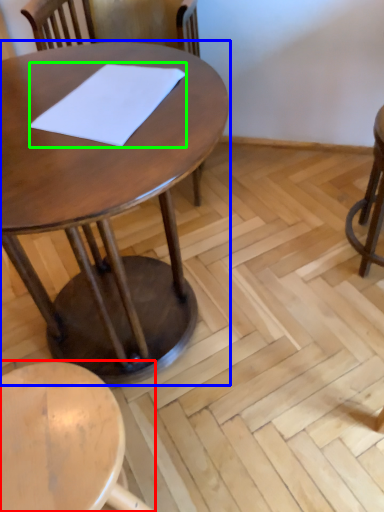
Question: Which object is the closest to the stool (highlighted by a red box)? Choose among these: table (highlighted by a blue box) or notepad (highlighted by a green box).

Choices:
 (A) table
 (B) notepad

Answer: (A)